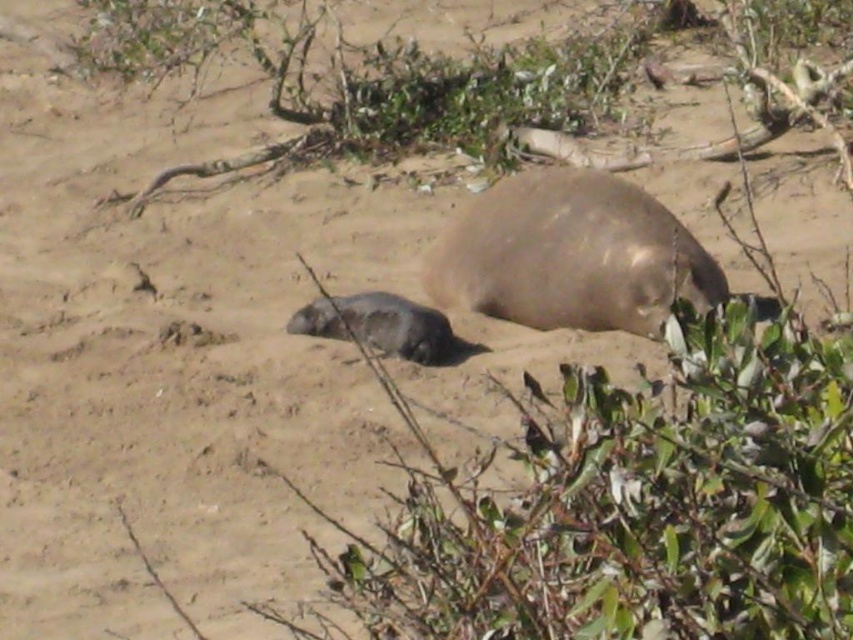
Between gray fur seal at center and gray fur seal pup at center, which one appears on the left side from the viewer's perspective?

Positioned to the left is gray fur seal pup at center.

Between point (544, 260) and point (320, 323), which one is positioned behind?

Point (544, 260)

At what (x,y) coordinates should I click in order to perform the action: click on gray fur seal at center. Please return your answer as a coordinate pair (x, y). Looking at the image, I should click on (570, 256).